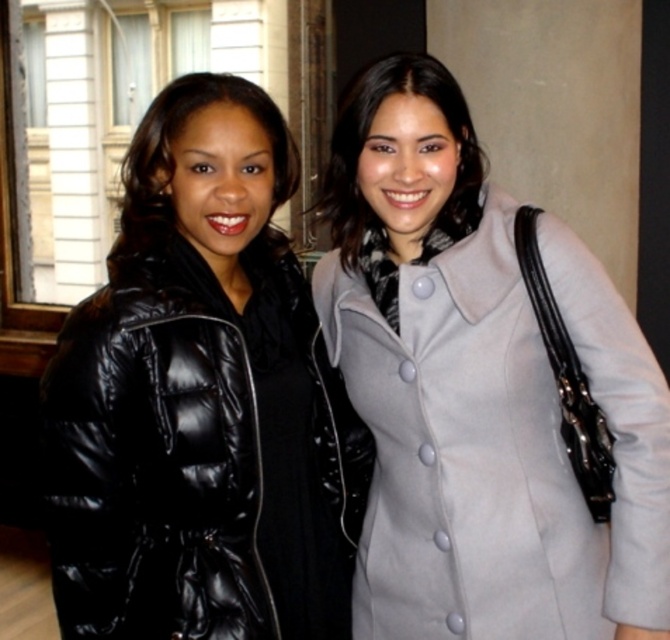
Between light gray wool coat at center and matte black coat at center, which one has less height?

With less height is matte black coat at center.

Does light gray wool coat at center appear over matte black coat at center?

No, light gray wool coat at center is not above matte black coat at center.

Is point (553, 241) closer to camera compared to point (362, 132)?

Yes, point (553, 241) is in front of point (362, 132).

You are a GUI agent. You are given a task and a screenshot of the screen. Output one action in this format:
    pyautogui.click(x=<x>, y=<y>)
    Task: Click on the light gray wool coat at center
    The width and height of the screenshot is (670, 640).
    Given the screenshot: What is the action you would take?
    pyautogui.click(x=498, y=445)

Is black glossy coat at left bigger than matte black coat at center?

Correct, black glossy coat at left is larger in size than matte black coat at center.

Is black glossy coat at left below matte black coat at center?

Correct, black glossy coat at left is located below matte black coat at center.

Between point (206, 534) and point (423, 250), which one is positioned behind?

Point (423, 250)

Image resolution: width=670 pixels, height=640 pixels. Identify the location of black glossy coat at left. (201, 419).

Is matte black coat at center positioned before black puffy coat at left?

Yes, it is in front of black puffy coat at left.

What do you see at coordinates (366, 138) in the screenshot? This screenshot has height=640, width=670. I see `matte black coat at center` at bounding box center [366, 138].

The height and width of the screenshot is (640, 670). Identify the location of matte black coat at center. (366, 138).